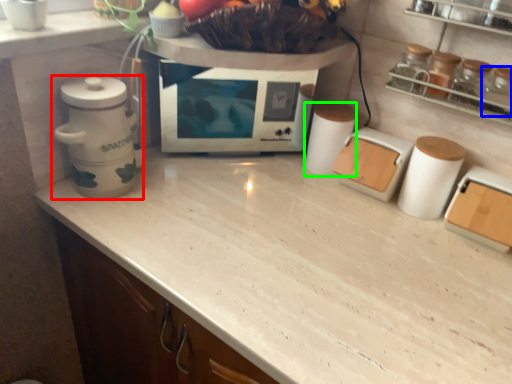
Question: Based on their relative distances, which object is nearer to home appliance (highlighted by a red box)? Choose from bottle (highlighted by a blue box) and appliance (highlighted by a green box).

Choices:
 (A) bottle
 (B) appliance

Answer: (B)